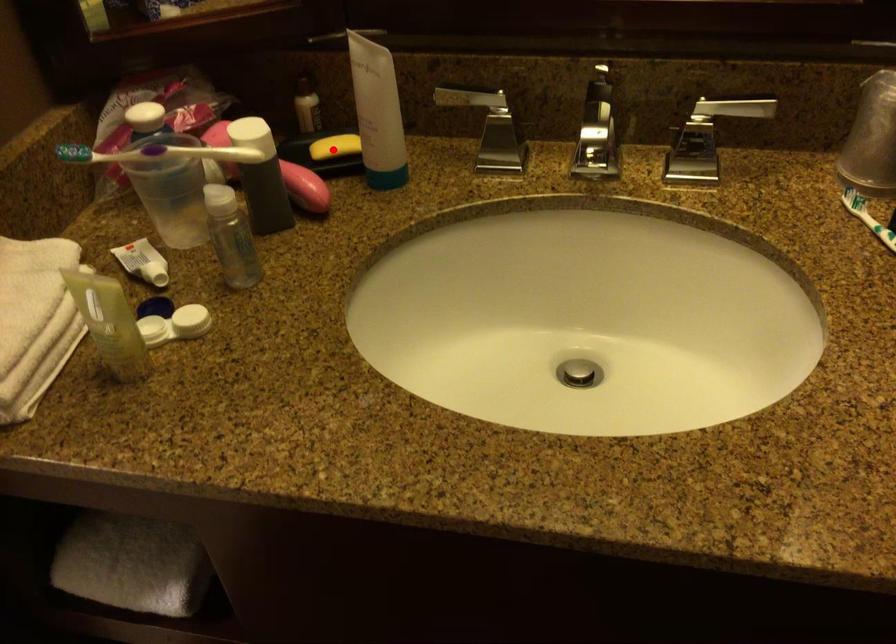
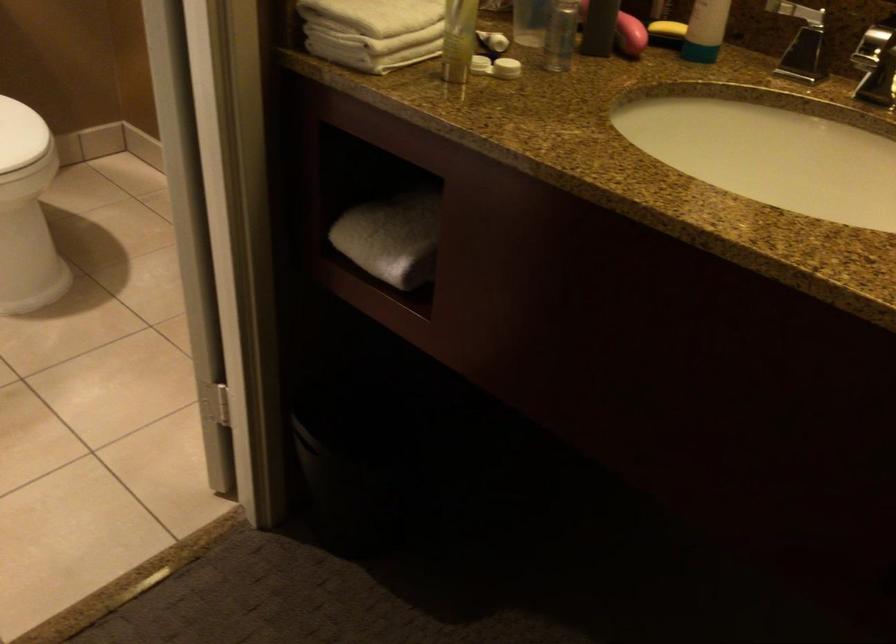
Where in the second image is the point corresponding to the highlighted location from the first image?

(667, 29)